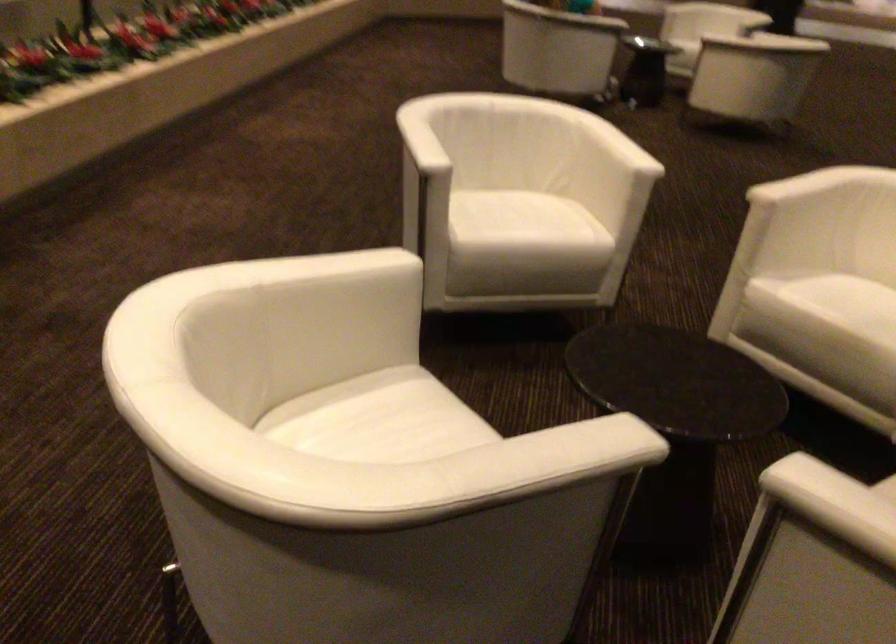
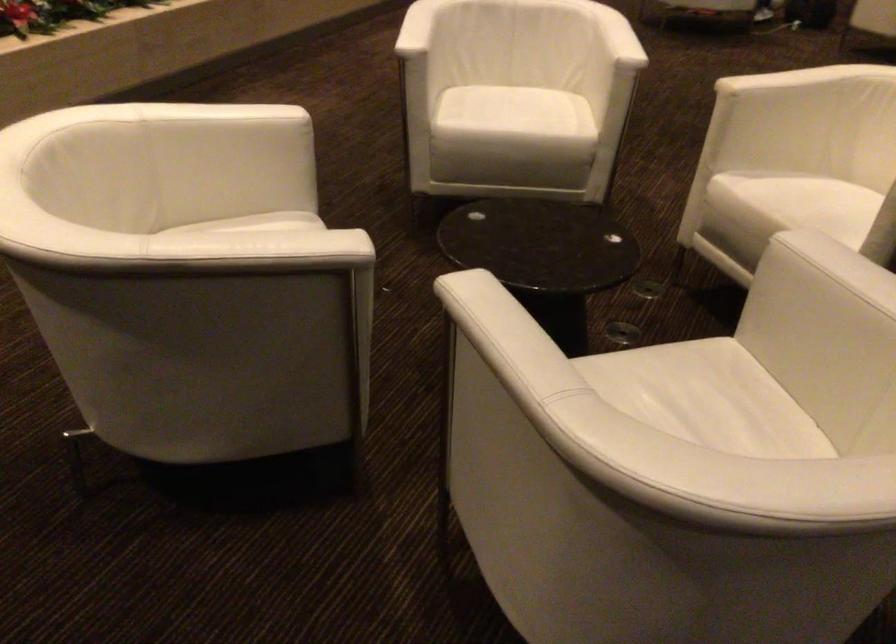
Find the pixel in the second image that matches (627,145) in the first image.

(617, 37)